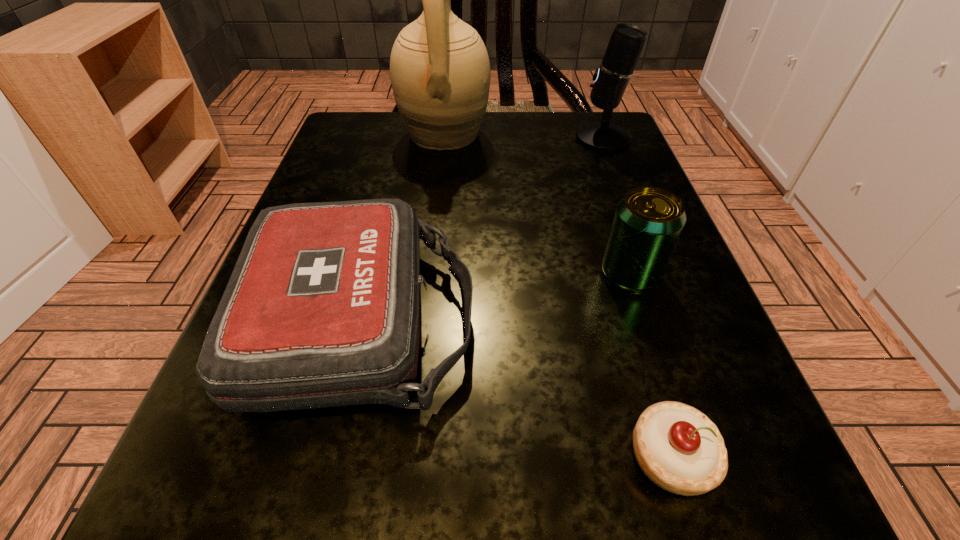
In order to click on pitcher in this screenshot , I will do `click(440, 73)`.

Where is `the second tallest object`? the second tallest object is located at coordinates (627, 41).

What are the coordinates of `the third tallest object` in the screenshot? It's located at (648, 221).

Locate an element on the screen. Image resolution: width=960 pixels, height=540 pixels. the second shortest object is located at coordinates (322, 309).

Identify the location of pastry. (679, 448).

At what (x,y) coordinates should I click in order to perform the action: click on free location located 0.350m on the front of the tallest object. Please return your answer as a coordinate pair (x, y). This screenshot has width=960, height=540. Looking at the image, I should click on (425, 305).

Image resolution: width=960 pixels, height=540 pixels. I want to click on blank space located 0.090m on the left of the fourth shortest object, so click(x=530, y=138).

Locate an element on the screen. The image size is (960, 540). vacant area situated on the left of the beer can is located at coordinates (536, 274).

What are the coordinates of `vacant space located 0.220m on the back of the fourth tallest object` in the screenshot? It's located at (397, 163).

You are a GUI agent. You are given a task and a screenshot of the screen. Output one action in this format:
    pyautogui.click(x=<x>, y=<y>)
    Task: Click on the free region located on the back of the shortest object
    
    Given the screenshot: What is the action you would take?
    pyautogui.click(x=644, y=368)